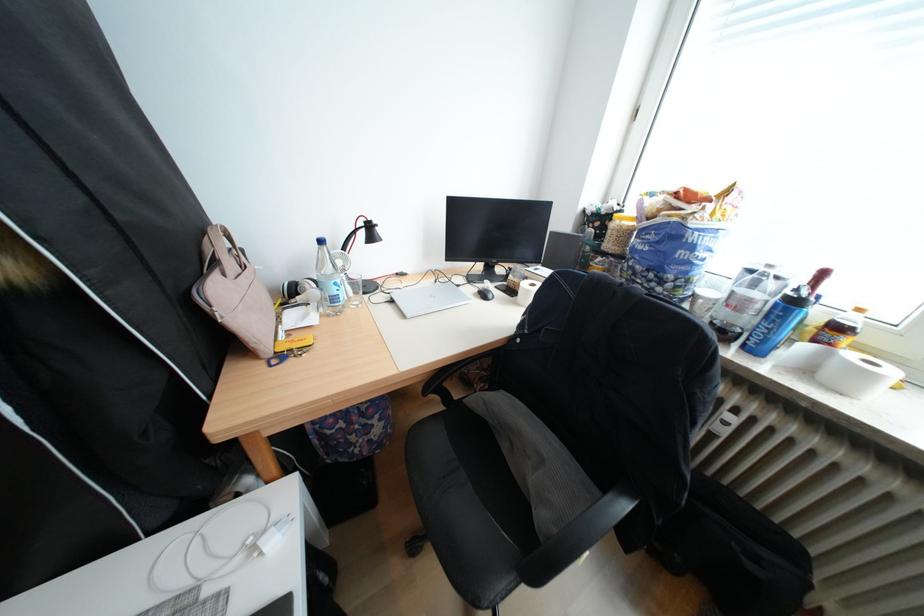
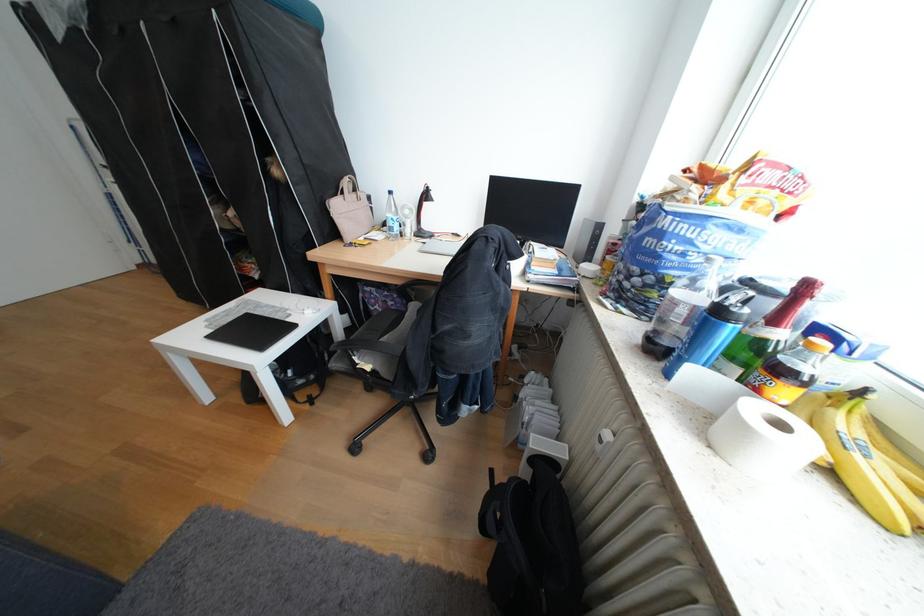
Locate, in the second image, the point that corresponds to point 227,264 in the first image.

(355, 193)